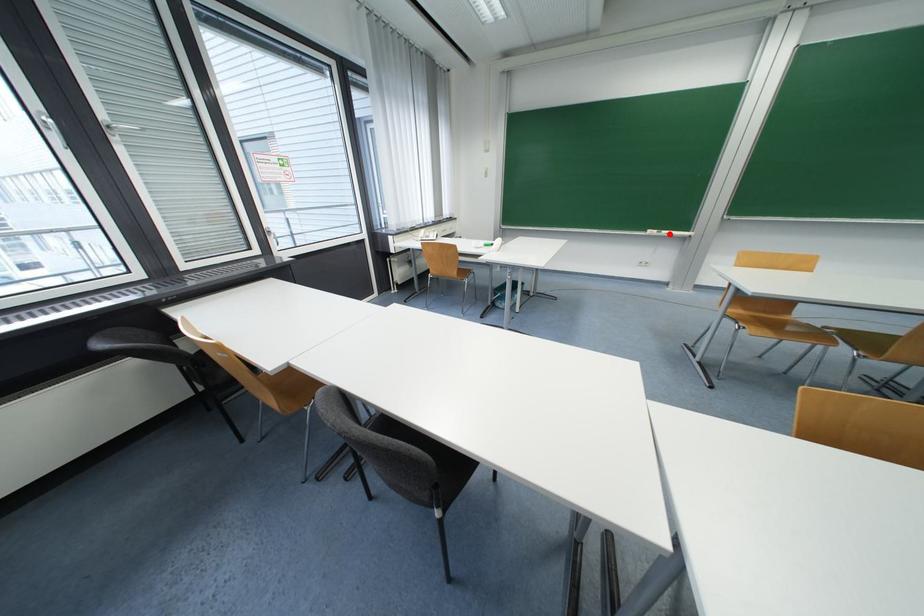
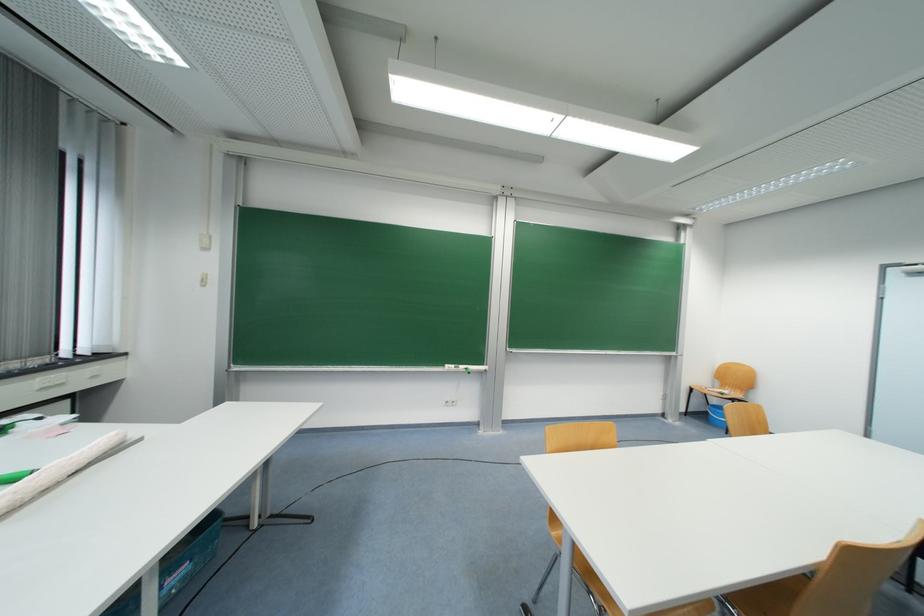
The point at the highlighted location is marked in the first image. Where is the corresponding point in the second image?

(467, 369)